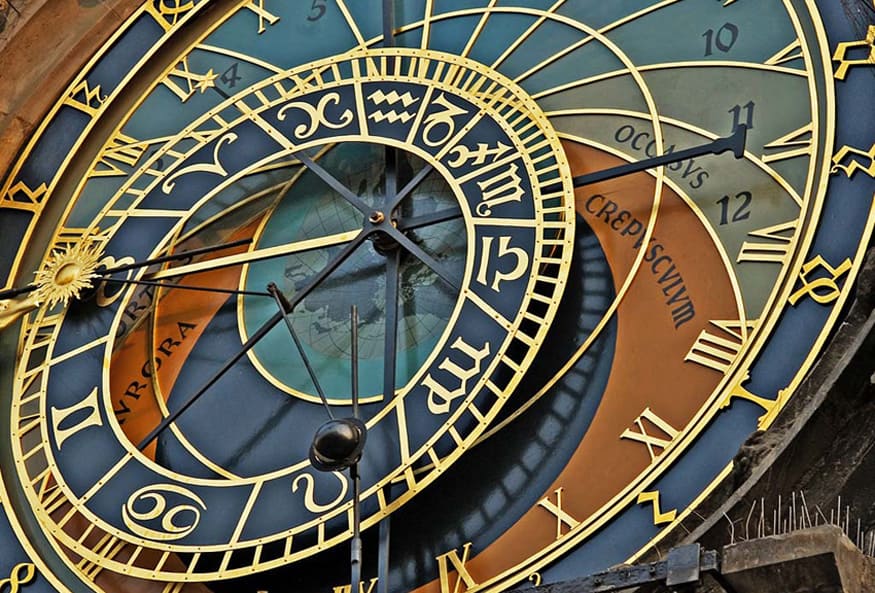
You are a GUI agent. You are given a task and a screenshot of the screen. Output one action in this format:
    pyautogui.click(x=<x>, y=<y>)
    Task: Click on the globe
    The height and width of the screenshot is (593, 875).
    Given the screenshot: What is the action you would take?
    pyautogui.click(x=329, y=279)